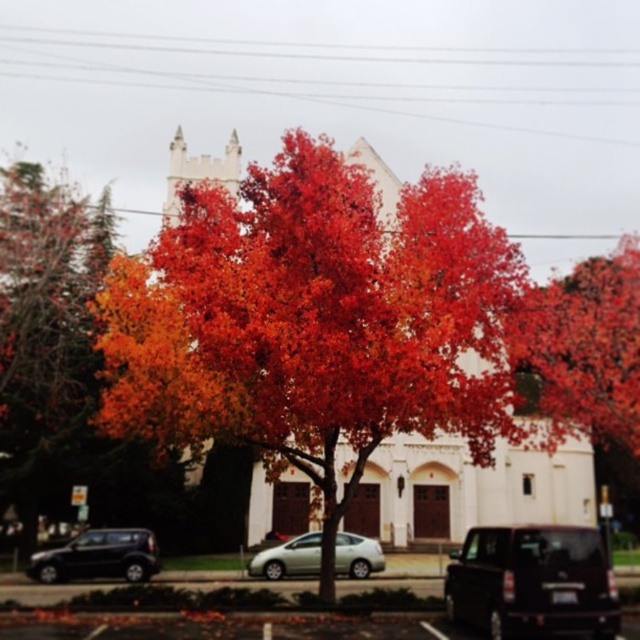
Consider the image. You are a delivery driver who needs to park your shiny black suv at lower left as close as possible to the shiny orange leaves at left without blocking the driveway. Can you park within 50 feet?

The shiny orange leaves at left is 50.15 feet away from shiny black suv at lower left. Since the distance is slightly over 50 feet, you cannot park within the required distance without exceeding it.

You are a photographer planning to capture the autumn tree and the car in the scene. Given that the shiny orange leaves at left are wider than the metallic silver sedan at center, which object should you focus on first to ensure both are in frame?

Since the shiny orange leaves at left are wider than the metallic silver sedan at center, you should focus on the shiny orange leaves at left first to accommodate their greater width within the frame.

You are a photographer wanting to capture the metallic silver sedan at center and the shiny orange leaves at left in the same frame. Based on their sizes in the image, which object would appear larger in your photo?

The shiny orange leaves at left would appear much larger in the photo than the metallic silver sedan at center because the description states that the shiny orange leaves at left is much taller as metallic silver sedan at center.